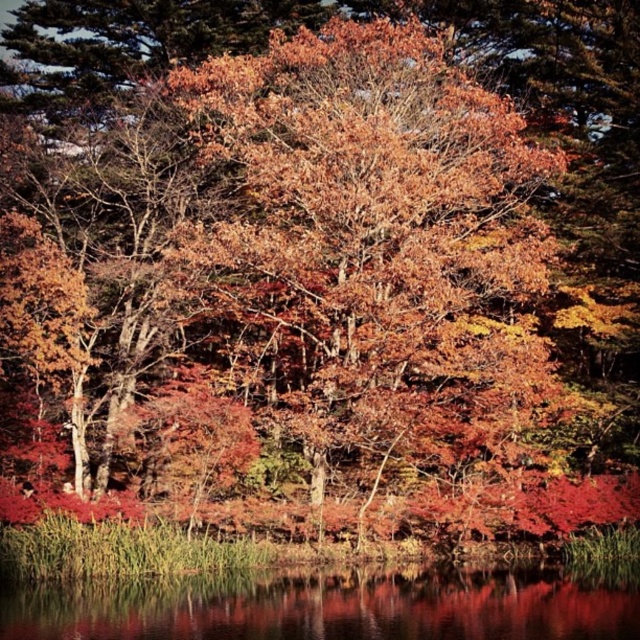
Question: Which point is farther from the camera taking this photo?

Choices:
 (A) (365, 394)
 (B) (403, 580)

Answer: (A)

Question: Observing the image, what is the correct spatial positioning of autumn leaves at center in reference to transparent water at lower center?

Choices:
 (A) left
 (B) right

Answer: (A)

Question: From the image, what is the correct spatial relationship of autumn leaves at center in relation to transparent water at lower center?

Choices:
 (A) right
 (B) left

Answer: (B)

Question: Does autumn leaves at center have a smaller size compared to transparent water at lower center?

Choices:
 (A) yes
 (B) no

Answer: (B)